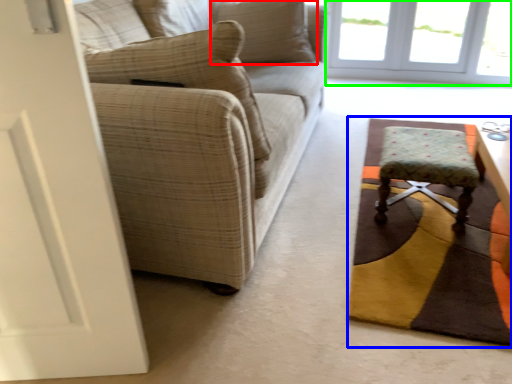
Question: Estimate the real-world distances between objects in this image. Which object is farther from pillow (highlighted by a red box), mat (highlighted by a blue box) or window (highlighted by a green box)?

Choices:
 (A) mat
 (B) window

Answer: (B)